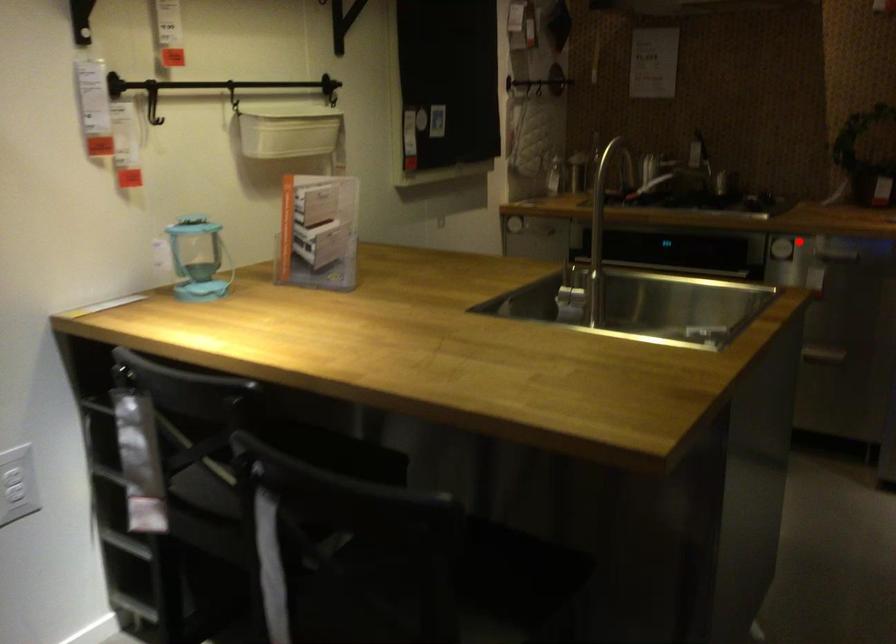
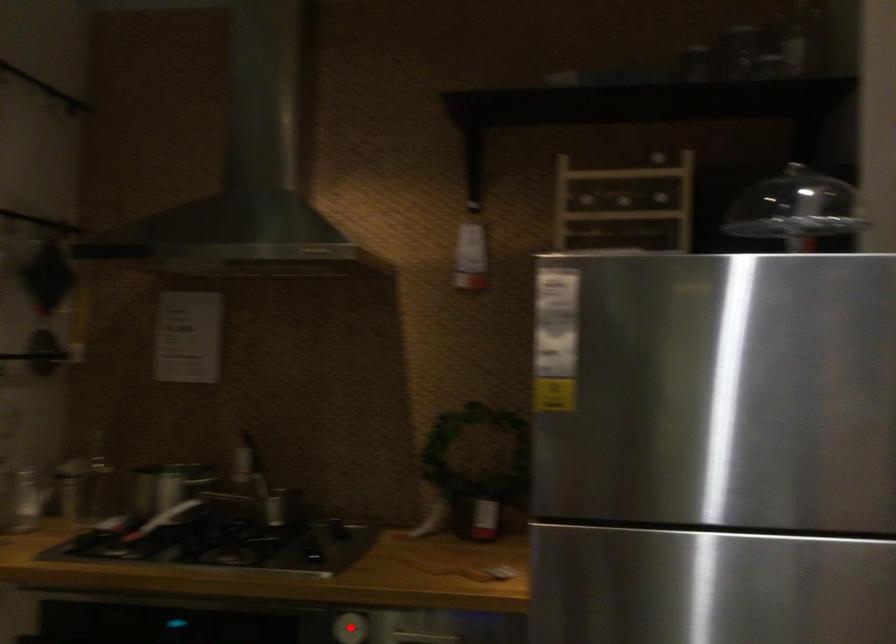
I am providing you with two images of the same scene from different viewpoints. A red point is marked on the first image and another point is marked on the second image. Are the points marked in image1 and image2 representing the same 3D position?

Yes